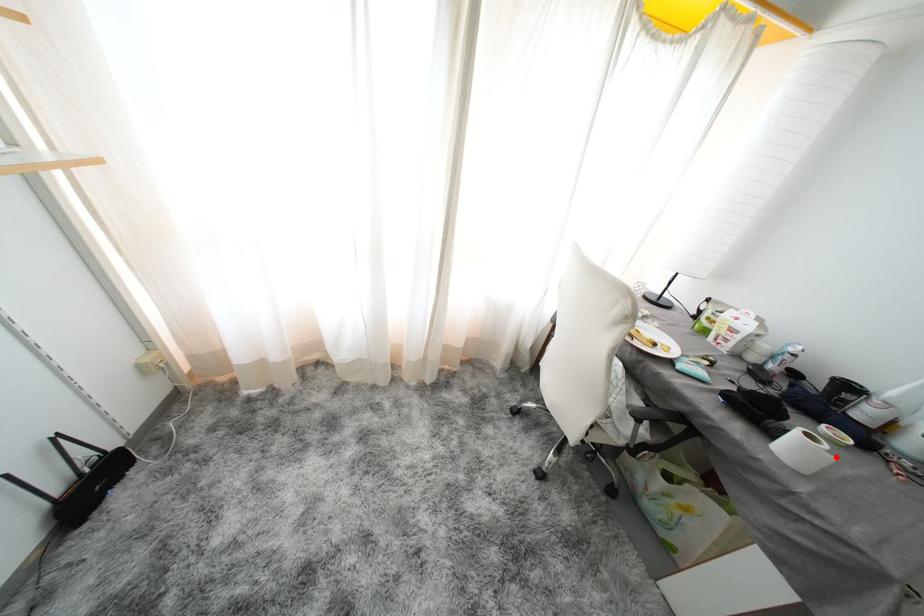
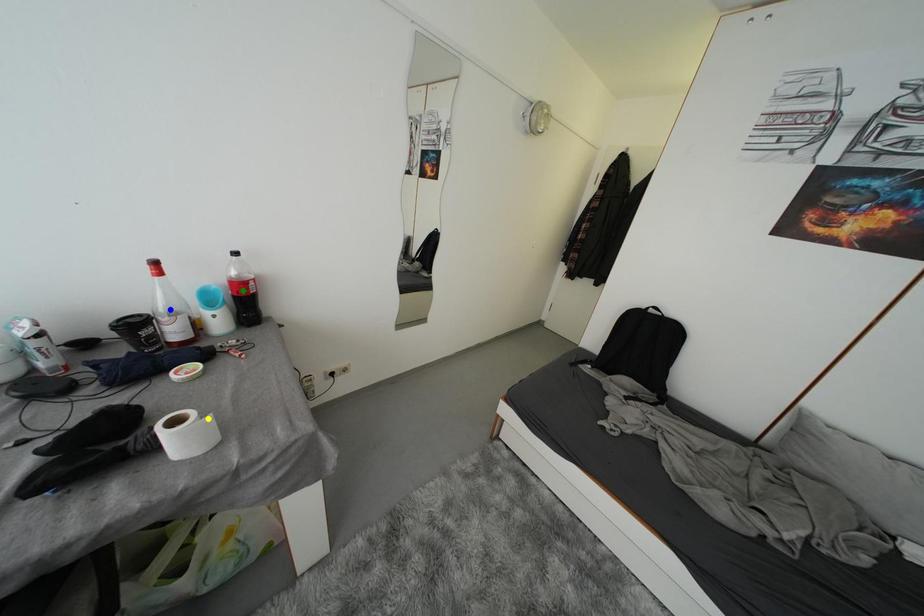
Question: I am providing you with two images of the same scene from different viewpoints. A red point is marked on the first image. You are given multiple points on the second image. Which point in image 2 is actually the same real-world point as the red point in image 1?

Choices:
 (A) yellow point
 (B) blue point
 (C) green point

Answer: (A)